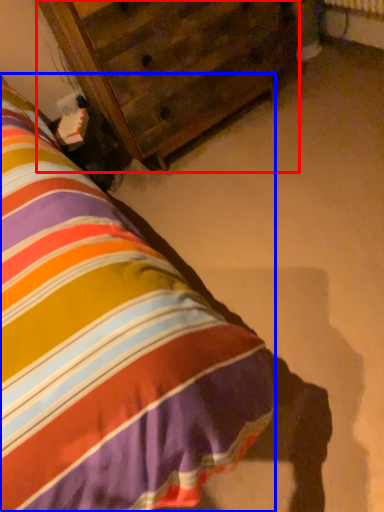
Question: Which of the following is the farthest to the observer, furniture (highlighted by a red box) or nightstand (highlighted by a blue box)?

Choices:
 (A) furniture
 (B) nightstand

Answer: (A)